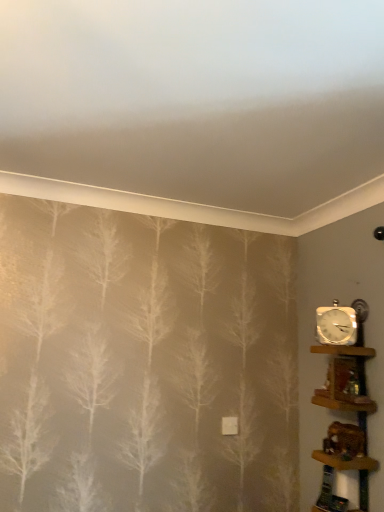
Question: Is wooden shelf at right, acting as the 1th shelf starting from the bottom, oriented towards white metallic clock at right?

Choices:
 (A) yes
 (B) no

Answer: (B)

Question: Is wooden shelf at right, acting as the 1th shelf starting from the bottom, smaller than white metallic clock at right?

Choices:
 (A) no
 (B) yes

Answer: (A)

Question: Can you confirm if wooden shelf at right, acting as the 1th shelf starting from the bottom, is shorter than white metallic clock at right?

Choices:
 (A) yes
 (B) no

Answer: (B)

Question: Can you confirm if wooden shelf at right, marked as the second shelf in a top-to-bottom arrangement, is positioned to the right of white metallic clock at right?

Choices:
 (A) no
 (B) yes

Answer: (A)

Question: Considering the relative positions of wooden shelf at right, marked as the second shelf in a top-to-bottom arrangement, and white metallic clock at right in the image provided, is wooden shelf at right, marked as the second shelf in a top-to-bottom arrangement, to the left of white metallic clock at right from the viewer's perspective?

Choices:
 (A) yes
 (B) no

Answer: (A)

Question: Is white metallic clock at right surrounded by wooden shelf at right, acting as the 1th shelf starting from the bottom?

Choices:
 (A) no
 (B) yes

Answer: (A)

Question: Is wooden shelf at right, the 2th shelf when ordered from bottom to top, surrounded by white metallic clock at right?

Choices:
 (A) no
 (B) yes

Answer: (A)

Question: Considering the relative sizes of white metallic clock at right and wooden shelf at right, the 2th shelf when ordered from bottom to top, in the image provided, is white metallic clock at right thinner than wooden shelf at right, the 2th shelf when ordered from bottom to top,?

Choices:
 (A) no
 (B) yes

Answer: (B)

Question: Is white metallic clock at right closer to the viewer compared to wooden shelf at right, the 1th shelf in the top-to-bottom sequence?

Choices:
 (A) yes
 (B) no

Answer: (B)

Question: From a real-world perspective, is white metallic clock at right located beneath wooden shelf at right, the 1th shelf in the top-to-bottom sequence?

Choices:
 (A) no
 (B) yes

Answer: (A)

Question: Considering the relative sizes of white metallic clock at right and wooden shelf at right, the 1th shelf in the top-to-bottom sequence, in the image provided, is white metallic clock at right wider than wooden shelf at right, the 1th shelf in the top-to-bottom sequence,?

Choices:
 (A) yes
 (B) no

Answer: (B)

Question: Is white metallic clock at right taller than wooden shelf at right, the 2th shelf when ordered from bottom to top?

Choices:
 (A) no
 (B) yes

Answer: (B)

Question: Considering the relative positions of wooden shelf at right, the 1th shelf in the top-to-bottom sequence, and wooden shelf at right, marked as the second shelf in a top-to-bottom arrangement, in the image provided, is wooden shelf at right, the 1th shelf in the top-to-bottom sequence, behind wooden shelf at right, marked as the second shelf in a top-to-bottom arrangement,?

Choices:
 (A) yes
 (B) no

Answer: (A)